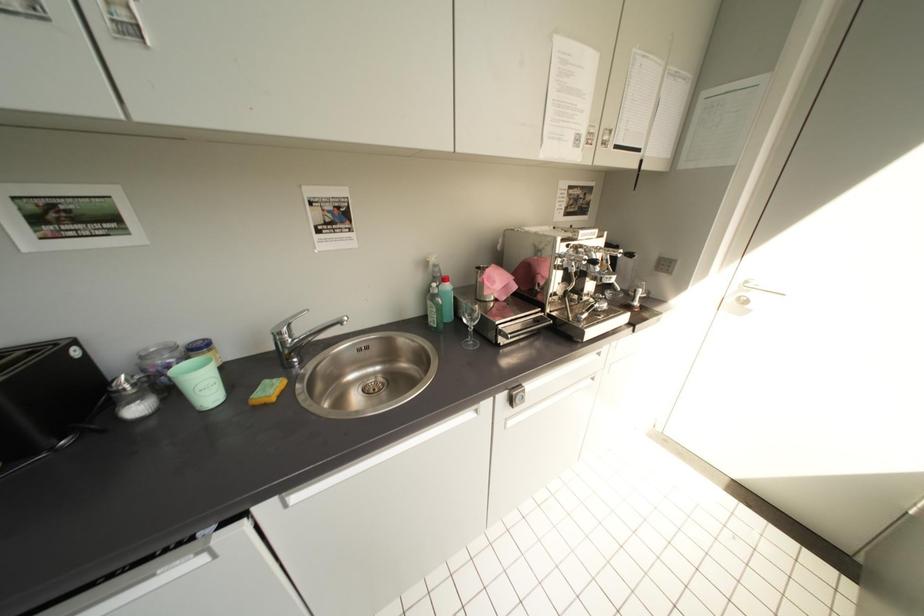
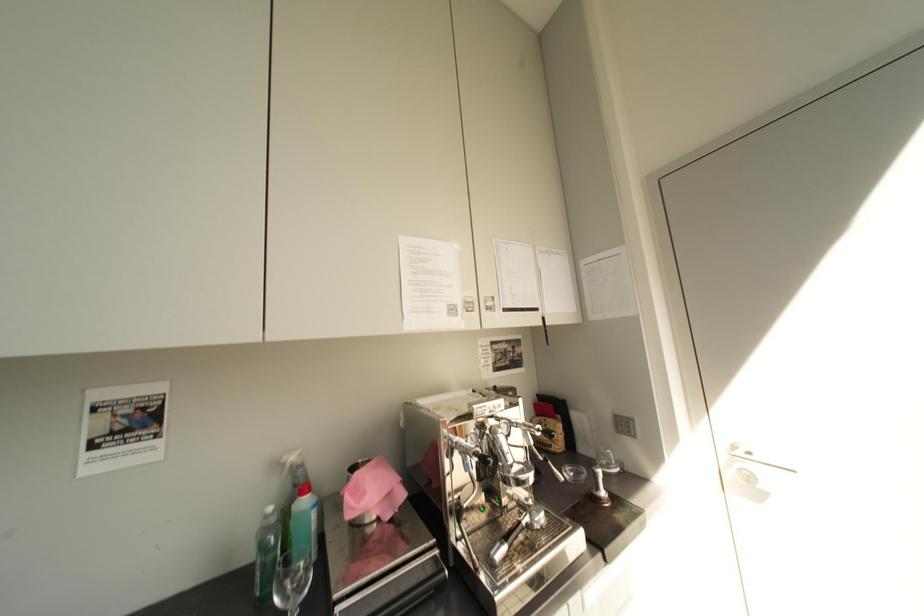
Question: The images are taken continuously from a first-person perspective. In which direction is your viewpoint rotating?

Choices:
 (A) Left
 (B) Right
 (C) Up
 (D) Down

Answer: (C)